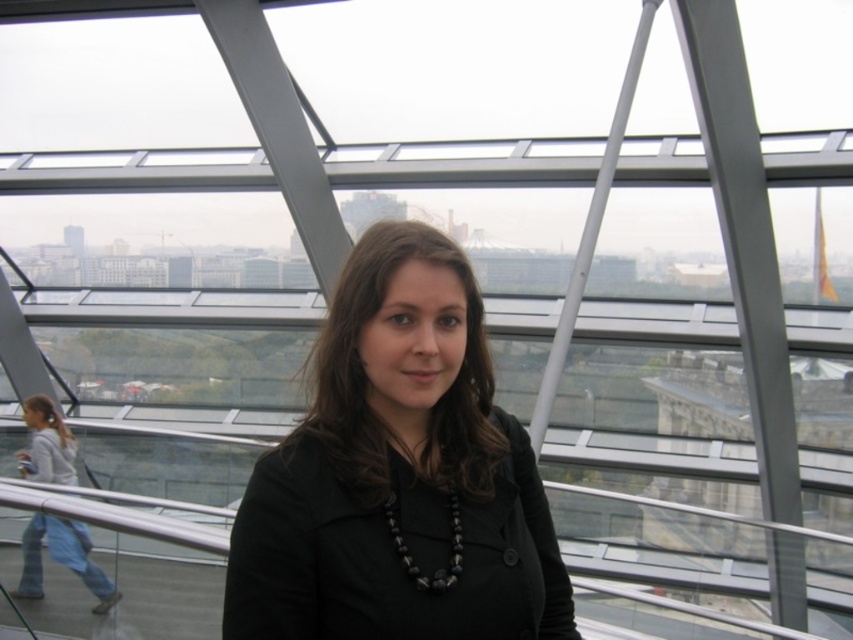
Question: Is black matte jacket at center closer to the viewer compared to light blue jeans at lower left?

Choices:
 (A) no
 (B) yes

Answer: (B)

Question: Which point appears closest to the camera in this image?

Choices:
 (A) (100, 570)
 (B) (540, 602)

Answer: (B)

Question: Which point is closer to the camera taking this photo?

Choices:
 (A) (396, 266)
 (B) (22, 472)

Answer: (A)

Question: Is black matte jacket at center further to the viewer compared to light blue jeans at lower left?

Choices:
 (A) no
 (B) yes

Answer: (A)

Question: Observing the image, what is the correct spatial positioning of black matte jacket at center in reference to light blue jeans at lower left?

Choices:
 (A) above
 (B) below

Answer: (A)